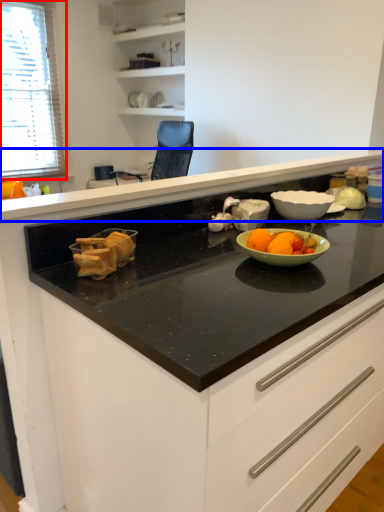
Question: Among these objects, which one is nearest to the camera, window (highlighted by a red box) or countertop (highlighted by a blue box)?

Choices:
 (A) window
 (B) countertop

Answer: (B)